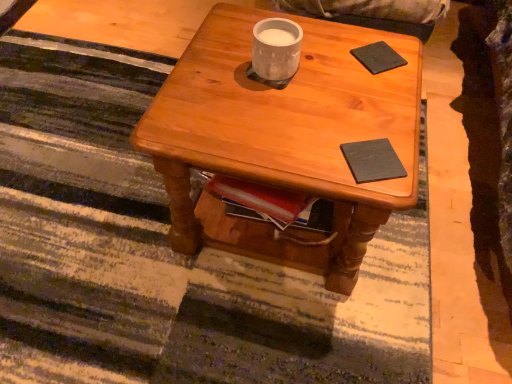
The image size is (512, 384). In order to click on vacant space behind dark matte book at center, the second pad from the top in this screenshot , I will do `click(360, 107)`.